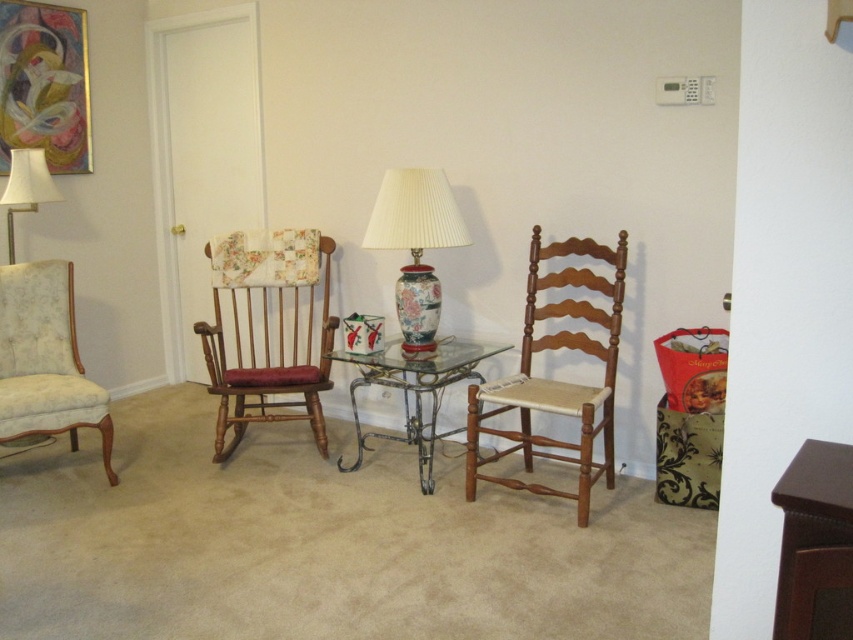
You are planning to place a rectangular rug in this room that is 1.2 meters wide. You have two chairs here, the wooden chair with woven seat at center and the wooden textured rocking chair at left. Which chair can fit entirely on the rug without any part hanging off if placed centrally?

The wooden chair with woven seat at center has a width less than the wooden textured rocking chair at left, so the wooden chair with woven seat at center can fit entirely on the 1.2 meter wide rug without any part hanging off when placed centrally.

You are moving a narrow bookshelf into this room. The bookshelf is 0.5 meters wide. You want to place it between the floral fabric armchair at left and the metallic wrought iron table at center. Is there enough space between them to fit the bookshelf?

The floral fabric armchair at left is thinner than the metallic wrought iron table at center. Since the bookshelf is 0.5 meters wide, and the space between the two objects depends on their widths, but the description only states the armchair is thinner. Without specific measurements of the space, it is uncertain if the bookshelf will fit. Please check the actual distance between them.